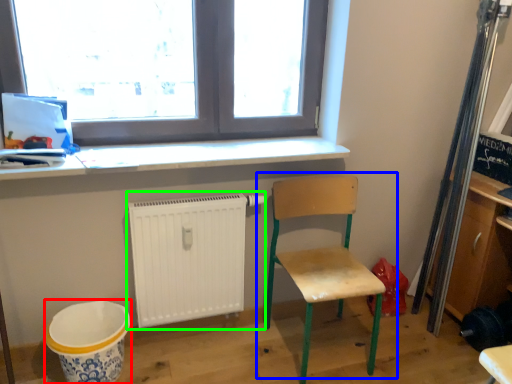
Question: Based on their relative distances, which object is nearer to mixing bowl (highlighted by a red box)? Choose from chair (highlighted by a blue box) and radiator (highlighted by a green box).

Choices:
 (A) chair
 (B) radiator

Answer: (B)